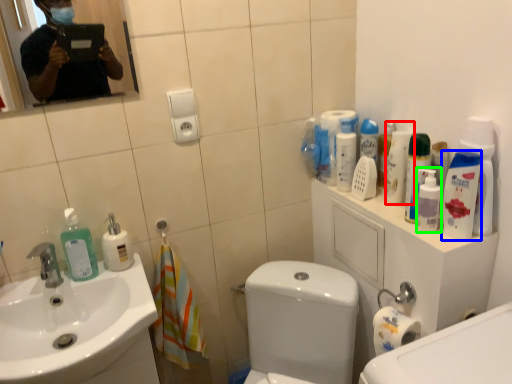
Question: Based on their relative distances, which object is farther from cleaning product (highlighted by a red box)? Choose from mouthwash (highlighted by a blue box) and cleaning product (highlighted by a green box).

Choices:
 (A) mouthwash
 (B) cleaning product

Answer: (A)